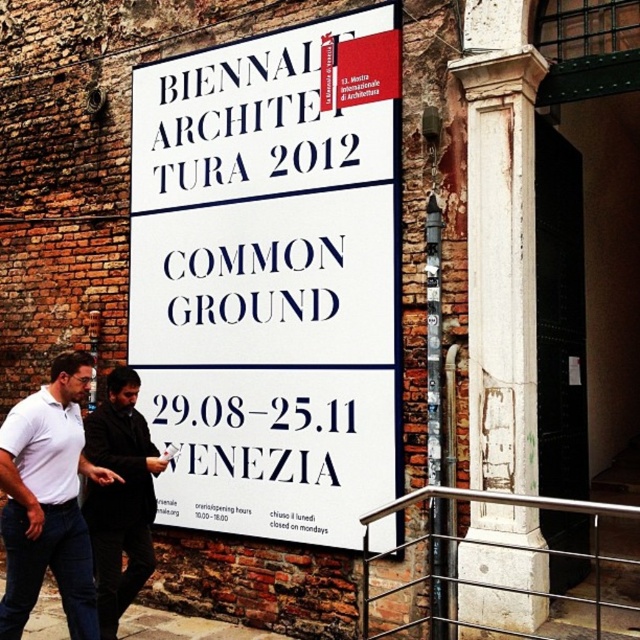
Question: Can you confirm if white stone column at center is positioned to the left of white cotton shirt at lower left?

Choices:
 (A) no
 (B) yes

Answer: (A)

Question: Which point is farther to the camera?

Choices:
 (A) (481, 145)
 (B) (96, 493)
 (C) (348, 147)

Answer: (C)

Question: From the image, what is the correct spatial relationship of white cotton shirt at lower left in relation to black fabric shirt at center?

Choices:
 (A) above
 (B) below

Answer: (A)

Question: Is white paper at center below black fabric shirt at center?

Choices:
 (A) yes
 (B) no

Answer: (B)

Question: Which of these objects is positioned closest to the white paper at center?

Choices:
 (A) white cotton shirt at lower left
 (B) blue text at center
 (C) black fabric shirt at center
 (D) white stone column at center

Answer: (B)

Question: Which object is the farthest from the white cotton shirt at lower left?

Choices:
 (A) white paper at center
 (B) black fabric shirt at center
 (C) white stone column at center
 (D) white paper sign at center

Answer: (C)